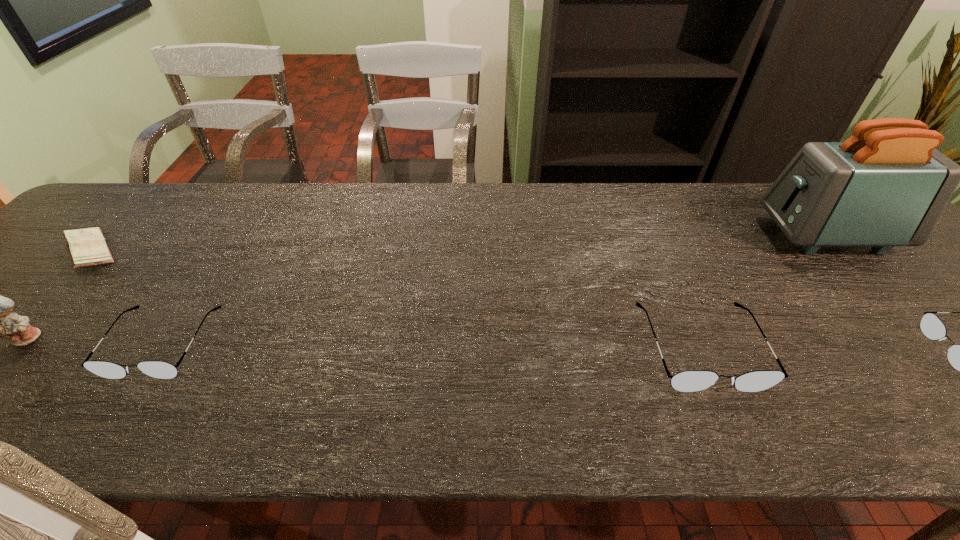
Find the location of `the second tallest spectacles`. the second tallest spectacles is located at coordinates (158, 369).

Where is `the leftmost spectacles`? This screenshot has width=960, height=540. the leftmost spectacles is located at coordinates (x=158, y=369).

Locate an element on the screen. This screenshot has width=960, height=540. the second spectacles from left to right is located at coordinates (690, 380).

Where is `the third object from right to left`? the third object from right to left is located at coordinates (690, 380).

What are the coordinates of `diary` in the screenshot? It's located at (87, 247).

This screenshot has height=540, width=960. In order to click on the fifth shortest object in this screenshot , I will do `click(0, 321)`.

Where is `toaster`? This screenshot has width=960, height=540. toaster is located at coordinates (885, 186).

Where is `blank space located 0.070m on the back of the diary`? blank space located 0.070m on the back of the diary is located at coordinates (126, 214).

At what (x,y) coordinates should I click in order to perform the action: click on vacant space situated 0.310m on the front-facing side of the tallest object. Please return your answer as a coordinate pair (x, y). Looking at the image, I should click on (651, 235).

You are a GUI agent. You are given a task and a screenshot of the screen. Output one action in this format:
    pyautogui.click(x=<x>, y=<y>)
    Task: Click on the free space located on the front-facing side of the tallest object
    
    Given the screenshot: What is the action you would take?
    pyautogui.click(x=647, y=235)